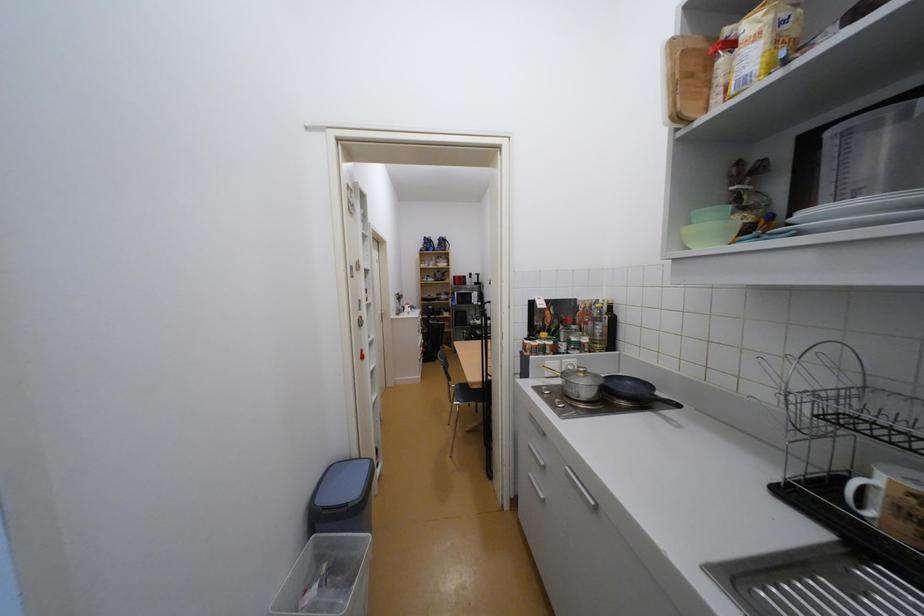
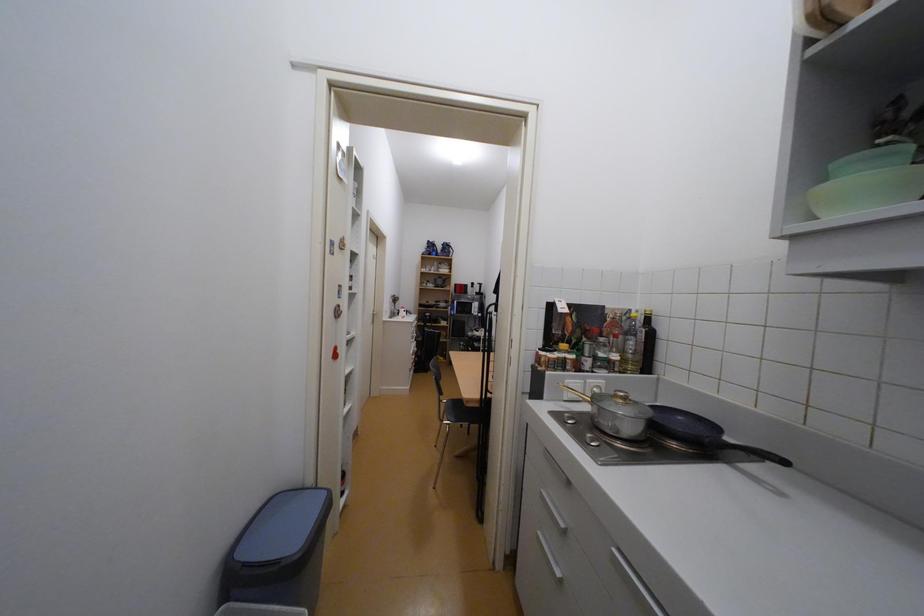
Question: The images are taken continuously from a first-person perspective. In which direction are you moving?

Choices:
 (A) Left
 (B) Right
 (C) Forward
 (D) Backward

Answer: (C)